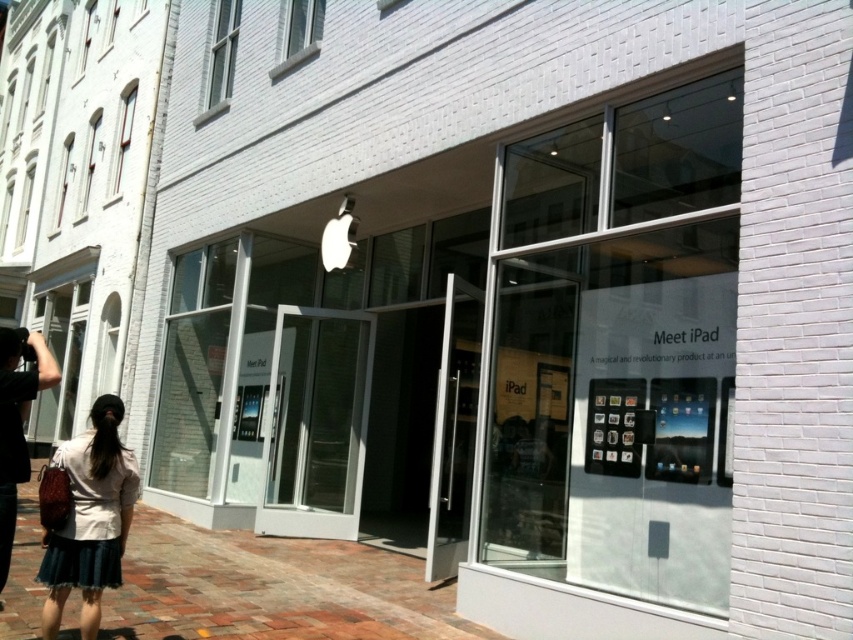
Is denim skirt at lower left positioned before black fabric bag at lower left?

No, denim skirt at lower left is behind black fabric bag at lower left.

Is denim skirt at lower left further to camera compared to black fabric bag at lower left?

Yes, it is behind black fabric bag at lower left.

Which is behind, point (84, 541) or point (0, 448)?

The point (84, 541) is behind.

Where is `denim skirt at lower left`? The height and width of the screenshot is (640, 853). denim skirt at lower left is located at coordinates (90, 518).

Between brick pavement at lower left and black fabric bag at lower left, which one appears on the left side from the viewer's perspective?

black fabric bag at lower left

Can you confirm if brick pavement at lower left is positioned to the left of black fabric bag at lower left?

Incorrect, brick pavement at lower left is not on the left side of black fabric bag at lower left.

What do you see at coordinates (271, 588) in the screenshot? I see `brick pavement at lower left` at bounding box center [271, 588].

The width and height of the screenshot is (853, 640). What are the coordinates of `brick pavement at lower left` in the screenshot? It's located at (271, 588).

In the scene shown: Which is more to the left, brick pavement at lower left or denim skirt at lower left?

From the viewer's perspective, denim skirt at lower left appears more on the left side.

Does brick pavement at lower left have a lesser width compared to denim skirt at lower left?

Incorrect, brick pavement at lower left's width is not less than denim skirt at lower left's.

This screenshot has width=853, height=640. Find the location of `brick pavement at lower left`. brick pavement at lower left is located at coordinates (271, 588).